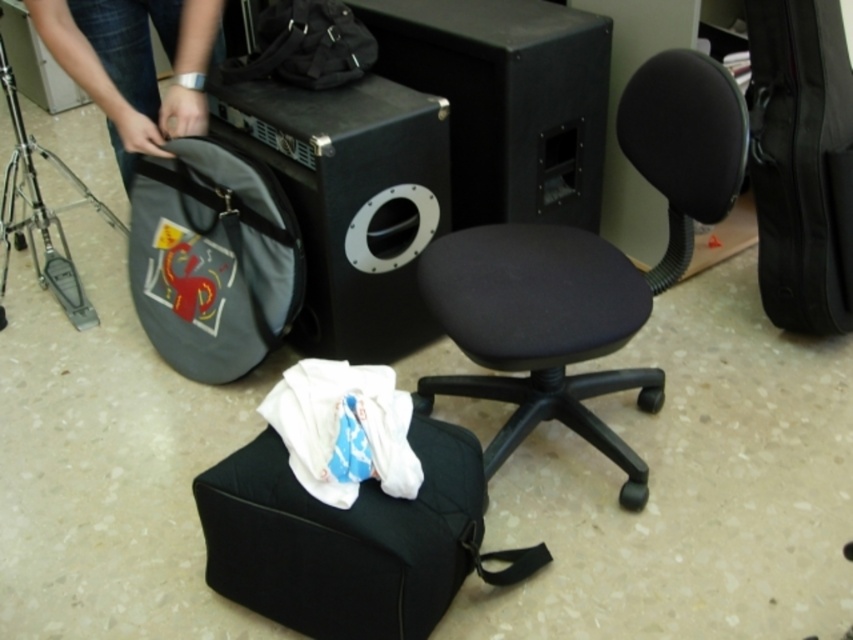
You are organizing items in a music room. You have a matte black bag at lower left and a matte black backpack at upper center. Which item is positioned more to the left side of the room?

The matte black bag at lower left is positioned more to the left side of the room than the matte black backpack at upper center.

You are a stagehand carrying a 1.5 meter long ladder. You need to move it from your current position to the black fabric swivel chair at center. Is there enough space to maneuver the ladder without tilting it?

The distance between you and the black fabric swivel chair at center is 1.49 meters. Since the ladder is 1.5 meters long, you would need to tilt it to maneuver through the space.

What are the coordinates of the black fabric swivel chair at center?

The black fabric swivel chair at center is located at coordinates point (587, 269).